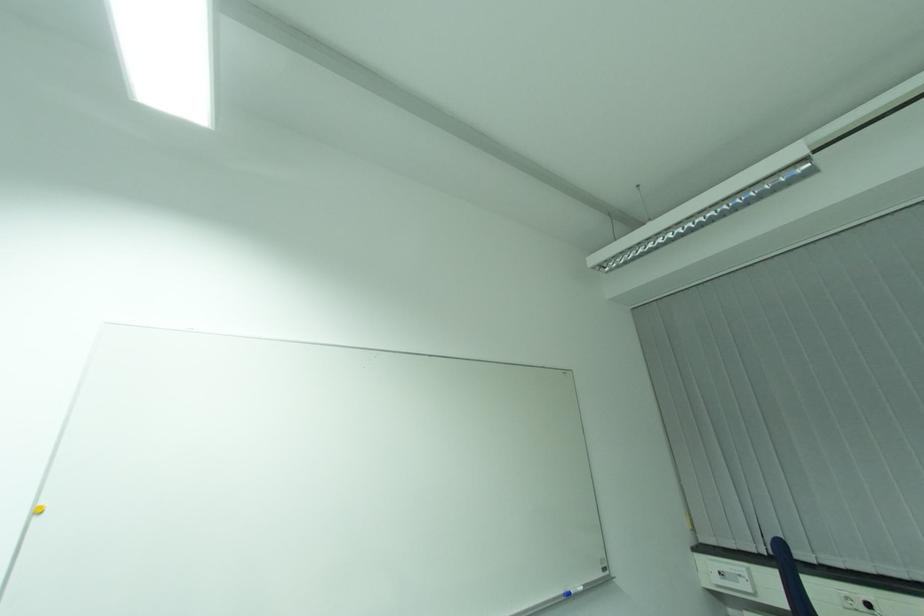
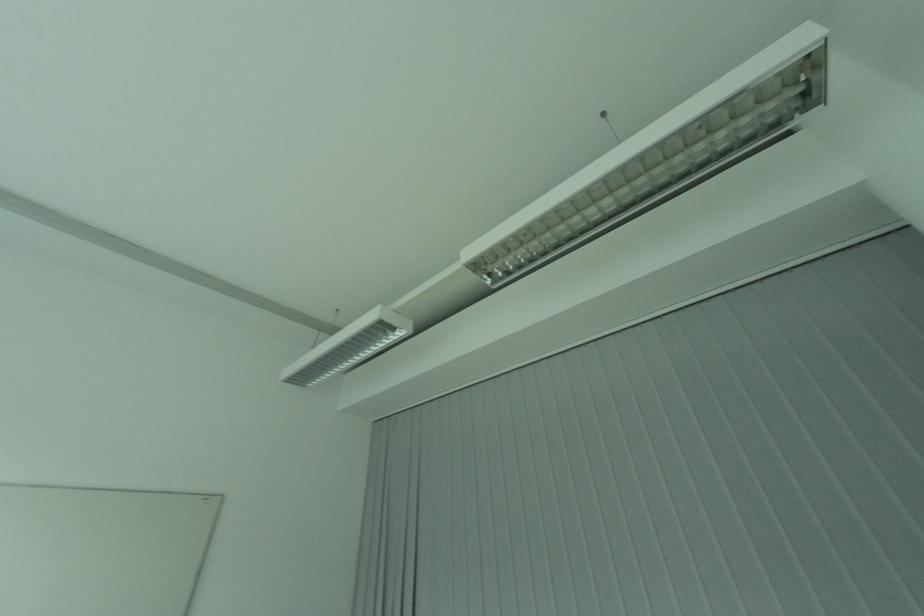
Question: In a continuous first-person perspective shot, in which direction is the camera moving?

Choices:
 (A) Left
 (B) Right
 (C) Forward
 (D) Backward

Answer: (B)